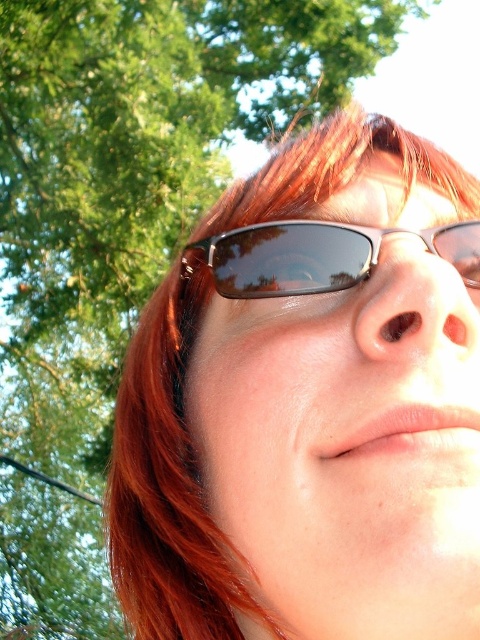
You are a photographer adjusting the focus on your camera. You notice two pairs of sunglasses in the frame. The first pair is the matte brown sunglasses at upper center, and the second pair is the sunglasses at center. Which pair of sunglasses should you focus on to ensure the larger one is sharp?

You should focus on the matte brown sunglasses at upper center because it is larger in size than the sunglasses at center.

You are a photographer adjusting the focus on your camera. You notice two sunglasses in the frame, the matte brown sunglasses at upper center and the sunglasses at center. Which one is closer to the camera?

The sunglasses at center is closer to the camera because they are positioned lower in the frame compared to the matte brown sunglasses at upper center, which is higher up. In photography, objects lower in the frame are typically closer to the viewer.